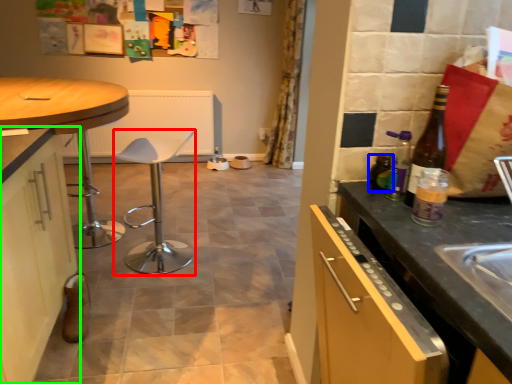
Question: Which object is positioned farthest from bar stool (highlighted by a red box)? Select from bottle (highlighted by a blue box) and cabinetry (highlighted by a green box).

Choices:
 (A) bottle
 (B) cabinetry

Answer: (A)